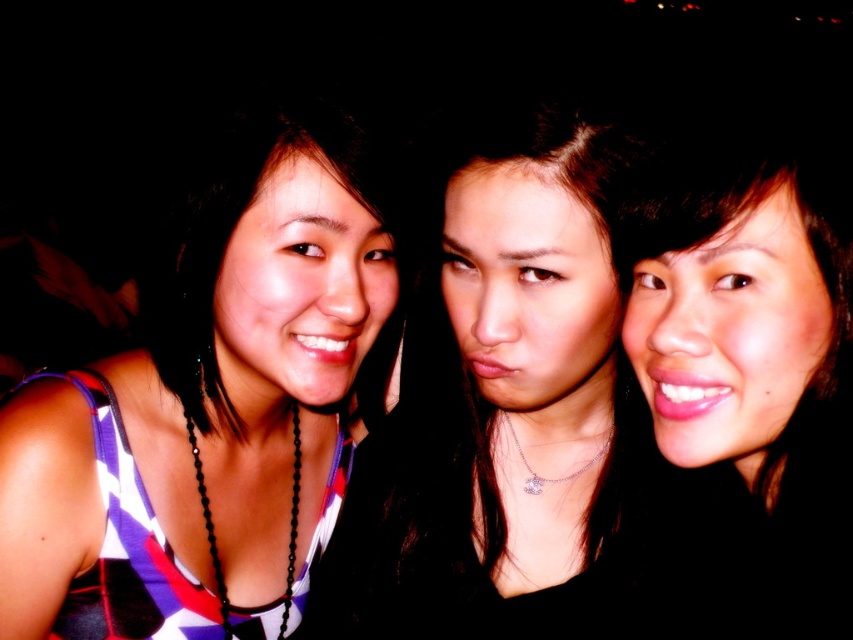
You are a photographer trying to adjust the lighting for a photo shoot. You notice the smooth black hair at center and the striped fabric dress at left. Which object is positioned farther from the camera?

The smooth black hair at center is behind the striped fabric dress at left, so it is farther from the camera.

You are a photographer trying to adjust the lighting for a photo shoot. You notice the striped fabric dress at left and the smooth skin at center. Which object requires more light to ensure proper exposure?

The striped fabric dress at left requires more light because it is larger in size than the smooth skin at center, so it needs more illumination to be properly exposed.

You are standing in front of the three people in the photo. You want to place a sticker on the point at point (519,474) and another sticker on point (772,260). Which sticker will be closer to you?

The point at point (772,260) will be closer to you because point (519,474) is behind it.